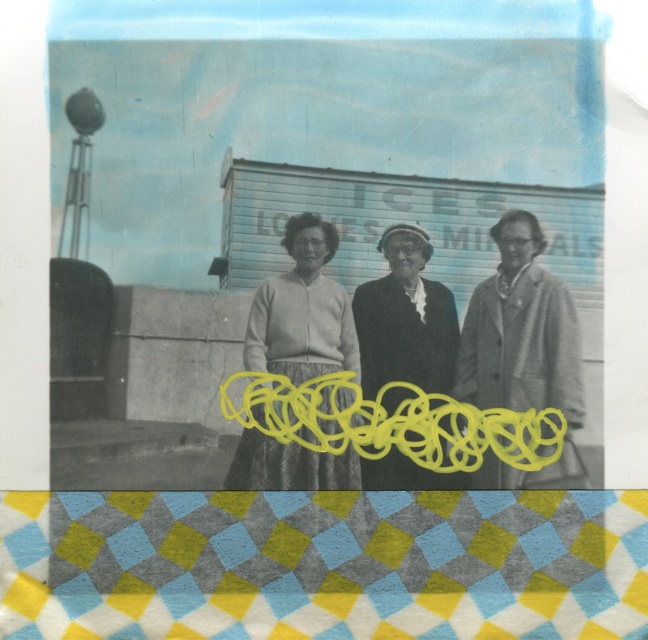
Question: Which point appears farthest from the camera in this image?

Choices:
 (A) (382, 401)
 (B) (544, 321)
 (C) (299, 262)
 (D) (393, 448)

Answer: (B)

Question: Can you confirm if light gray wool coat at center is positioned below smooth black coat at center?

Choices:
 (A) no
 (B) yes

Answer: (A)

Question: Which point is farther from the camera taking this photo?

Choices:
 (A) (336, 324)
 (B) (283, 372)
 (C) (397, 376)

Answer: (A)

Question: Does light gray wool coat at center appear on the left side of knitted sweater at center?

Choices:
 (A) yes
 (B) no

Answer: (B)

Question: Is matte gray sweater at center to the left of smooth black coat at center from the viewer's perspective?

Choices:
 (A) no
 (B) yes

Answer: (B)

Question: Which is nearer to the matte gray sweater at center?

Choices:
 (A) light gray wool coat at center
 (B) knitted sweater at center

Answer: (B)